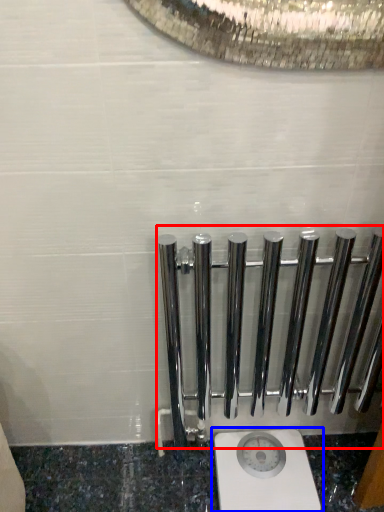
Question: Which point is further to the camera, rail (highlighted by a red box) or toilet (highlighted by a blue box)?

Choices:
 (A) rail
 (B) toilet

Answer: (B)